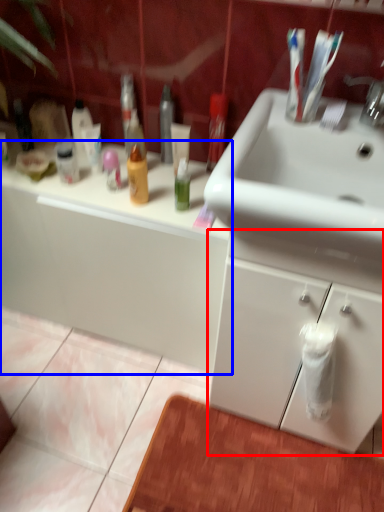
Question: Which point is further to the camera, bathroom cabinet (highlighted by a red box) or bathroom cabinet (highlighted by a blue box)?

Choices:
 (A) bathroom cabinet
 (B) bathroom cabinet

Answer: (B)